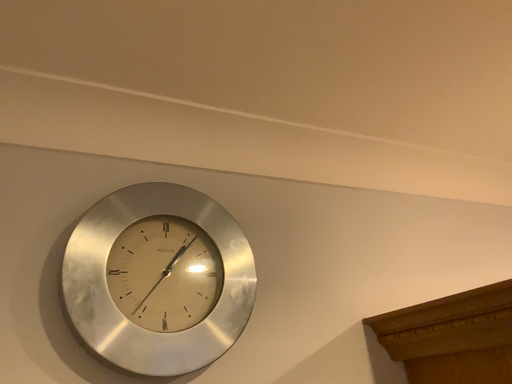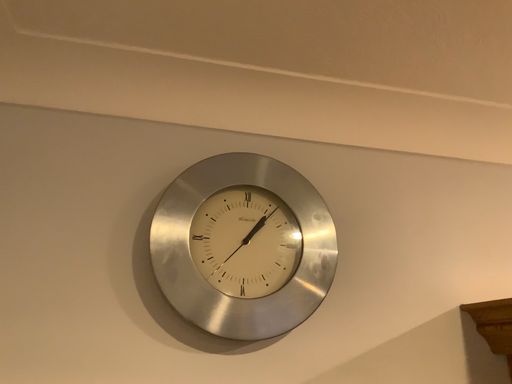
Question: How did the camera likely rotate when shooting the video?

Choices:
 (A) rotated right
 (B) rotated left

Answer: (B)